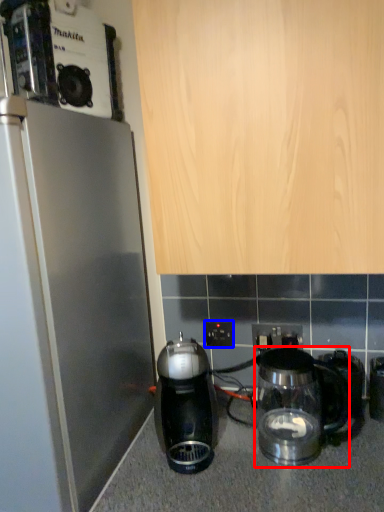
Question: Among these objects, which one is farthest to the camera, kitchen appliance (highlighted by a red box) or electric outlet (highlighted by a blue box)?

Choices:
 (A) kitchen appliance
 (B) electric outlet

Answer: (B)